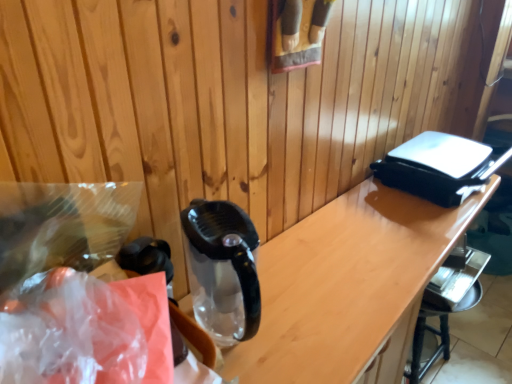
Image resolution: width=512 pixels, height=384 pixels. In order to click on free point above transparent plastic bag at left (from a real-world perspective) in this screenshot , I will do `click(81, 309)`.